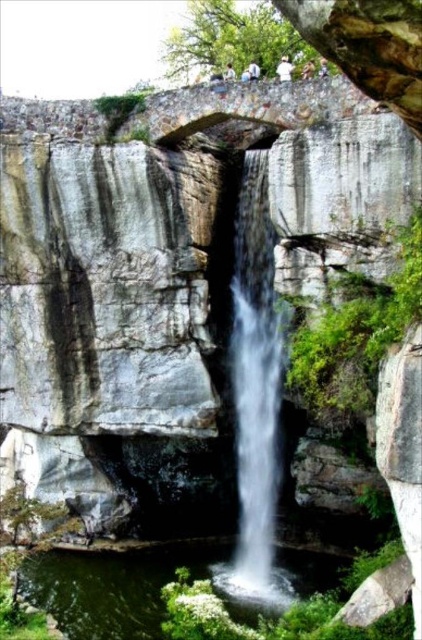
You are standing at the base of the waterfall and want to reach both points marked in the image. Which point, point (251, 236) or point (256, 612), is closer to you?

Point (251, 236) is closer to you because it is further to the viewer than point (256, 612).

You are a geologist studying the waterfall and its surrounding rock formations. You need to determine the exact location of the white smooth waterfall at center for your report. Based on the coordinates provided, can you confirm its position relative to the center of the image?

The white smooth waterfall at center is located at coordinates approximately 61 percent in both the x and y axes, meaning it is slightly offset to the right and down from the true center of the image.

You are a hiker standing at the base of the white smooth waterfall at center. You want to take a photo of the waterfall from a closer position. The camera you have can focus on objects as close as 100 feet away. Can you move closer to the waterfall to take the photo?

The white smooth waterfall at center is 215.49 feet away from the camera. Since the camera can focus as close as 100 feet, you can move closer to the waterfall until you are within 100 feet to take the photo.